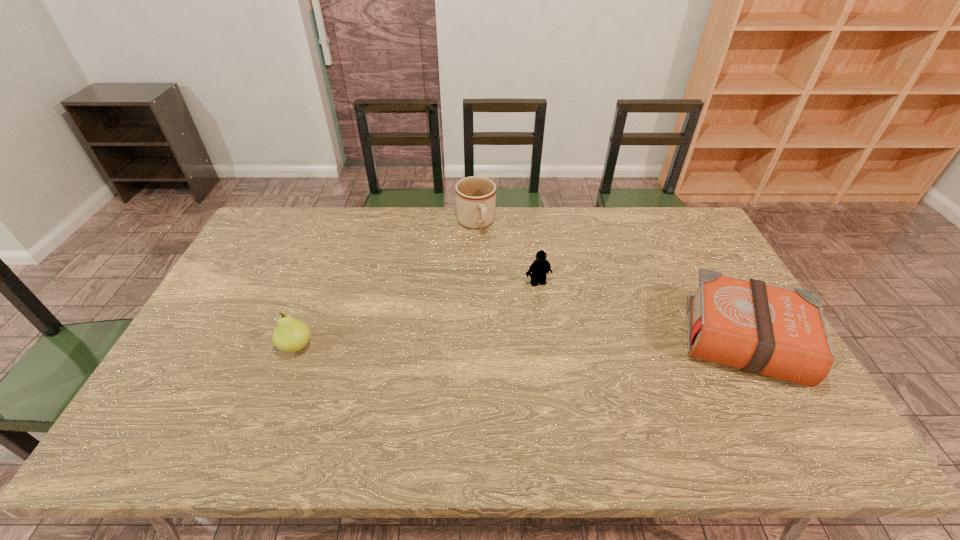
Identify the location of vacant space located on the side of the mug with the handle. This screenshot has height=540, width=960. tap(503, 293).

Identify the location of vacant space situated 0.080m on the face of the third object from left to right. [551, 305].

Identify the location of free region located on the face of the third object from left to right. The image size is (960, 540). (591, 387).

Identify the location of vacant space situated 0.190m on the face of the third object from left to right. (564, 333).

I want to click on object situated at the far edge, so click(x=475, y=196).

Locate an element on the screen. This screenshot has width=960, height=540. object located at the near edge is located at coordinates (760, 328).

Locate an element on the screen. Image resolution: width=960 pixels, height=540 pixels. object positioned at the right edge is located at coordinates (760, 328).

The image size is (960, 540). In order to click on object located at the near right corner in this screenshot , I will do `click(760, 328)`.

The height and width of the screenshot is (540, 960). I want to click on vacant space at the far edge of the desktop, so click(x=560, y=247).

Find the location of a particular element. The height and width of the screenshot is (540, 960). vacant region at the near edge of the desktop is located at coordinates pyautogui.click(x=374, y=410).